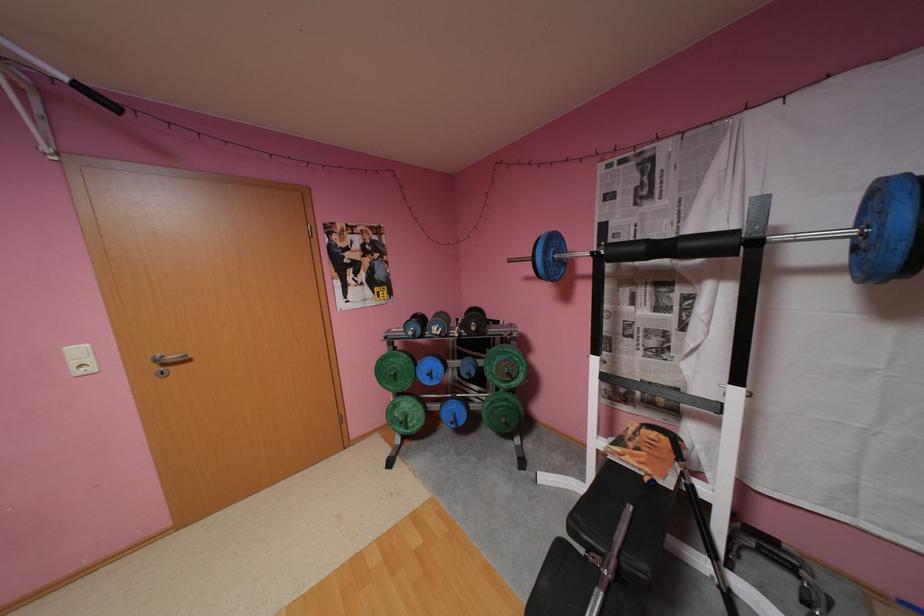
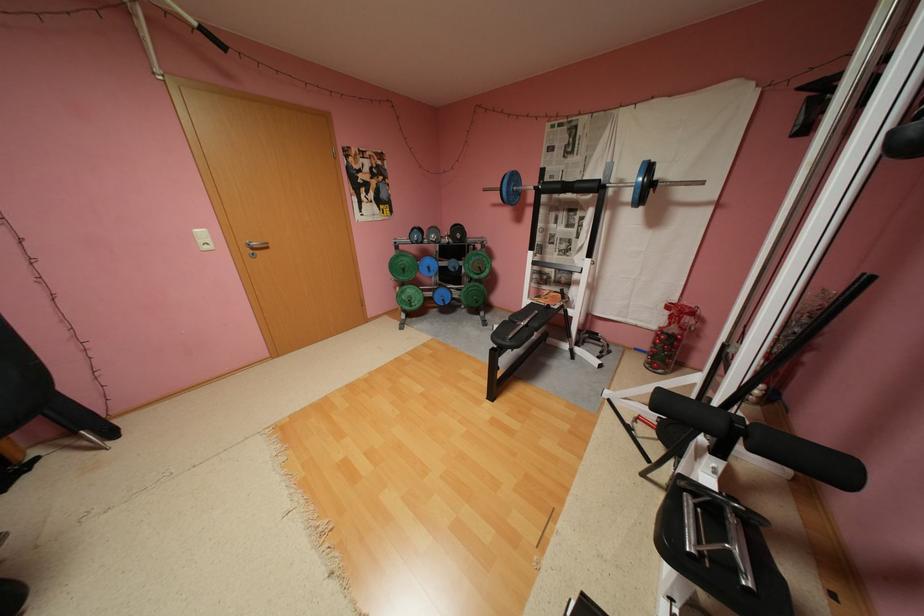
The images are taken continuously from a first-person perspective. In which direction are you moving?

The movement direction of the cameraman is left, backward.